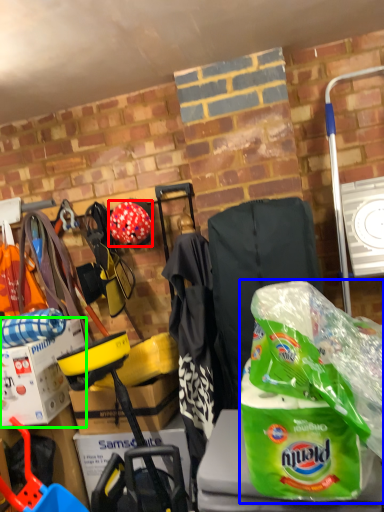
Question: Which object is positioned farthest from helmet (highlighted by a red box)? Select from plastic bag (highlighted by a blue box) and box (highlighted by a green box).

Choices:
 (A) plastic bag
 (B) box

Answer: (A)